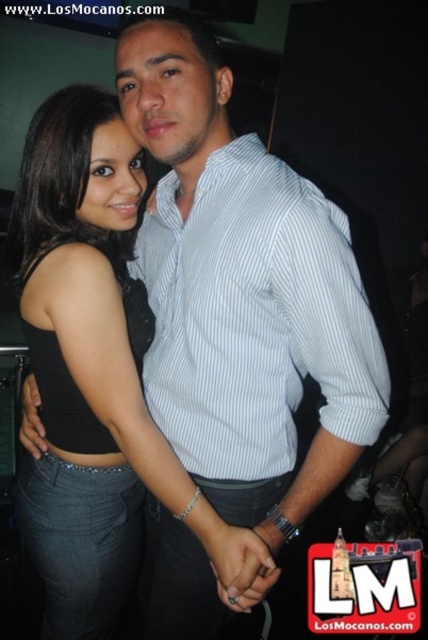
Does point (83, 218) come closer to viewer compared to point (287, 435)?

No, it is behind (287, 435).

This screenshot has height=640, width=428. I want to click on black matte tank top at center, so click(x=94, y=369).